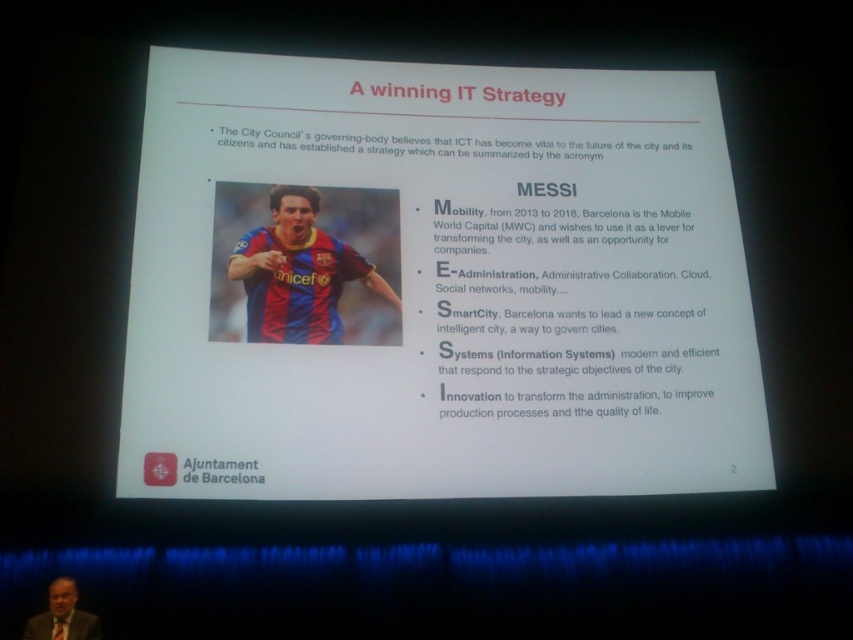
Question: Does blue jersey at left have a lesser width compared to blue and red jersey at center?

Choices:
 (A) yes
 (B) no

Answer: (B)

Question: Where is blue jersey at left located in relation to blue and red jersey at center in the image?

Choices:
 (A) above
 (B) below

Answer: (A)

Question: Is blue and red jersey at center positioned at the back of matte black suit at lower left?

Choices:
 (A) no
 (B) yes

Answer: (B)

Question: Which point is farther to the camera?

Choices:
 (A) (380, 195)
 (B) (45, 630)

Answer: (A)

Question: Which object is positioned farthest from the blue jersey at left?

Choices:
 (A) blue and red jersey at center
 (B) matte black suit at lower left

Answer: (B)

Question: Among these objects, which one is nearest to the camera?

Choices:
 (A) matte black suit at lower left
 (B) blue jersey at left

Answer: (A)